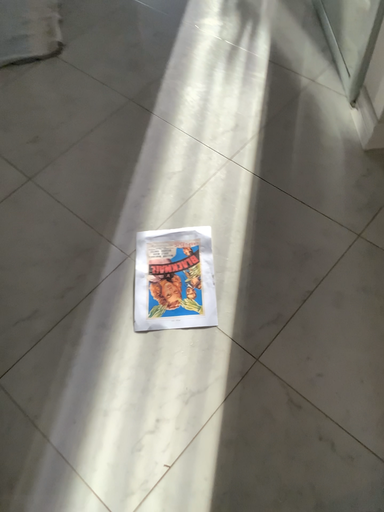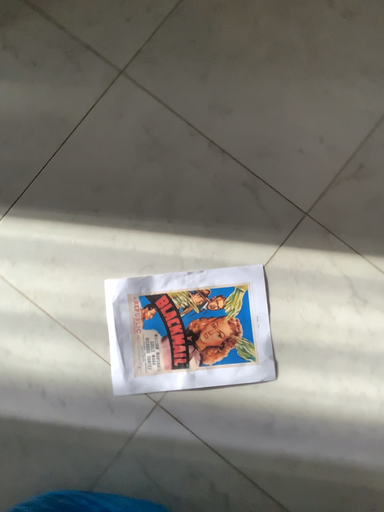
Question: How did the camera likely rotate when shooting the video?

Choices:
 (A) rotated left
 (B) rotated right

Answer: (B)